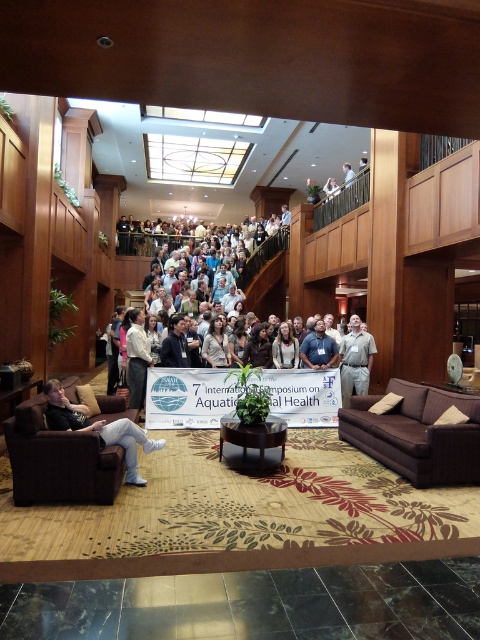
You are a guest at the hotel and want to sit down. You see the light brown wooden chair at upper center and the white fabric at upper center. Which one is larger in size?

The light brown wooden chair at upper center is bigger than the white fabric at upper center.

You are a guest at the event and want to sit down. You see the dark gray fabric couch at lower left and the light blue shirt at center. Which seating option is bigger?

The dark gray fabric couch at lower left is larger in size than the light blue shirt at center, so the dark gray fabric couch at lower left is the bigger seating option.

You are standing in the hotel lobby and want to sit down. You see the dark gray fabric couch at lower left and the white fabric at upper center. Which one is closer to the ground?

The dark gray fabric couch at lower left is closer to the ground since it is below the white fabric at upper center.